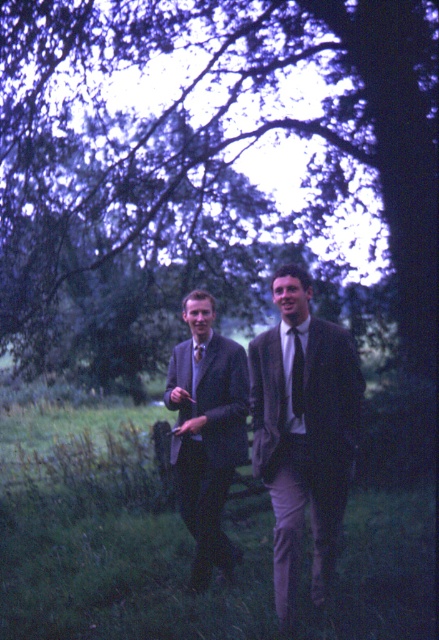
You are a photographer trying to capture a group photo of the two people wearing matte brown suit at center and matte black suit at center. Since you want to ensure both are clearly visible, which one should you focus on first to avoid blurring due to their size difference?

The matte brown suit at center is smaller than the matte black suit at center, so you should focus on the matte brown suit at center first to ensure clarity before adjusting for the larger figure.